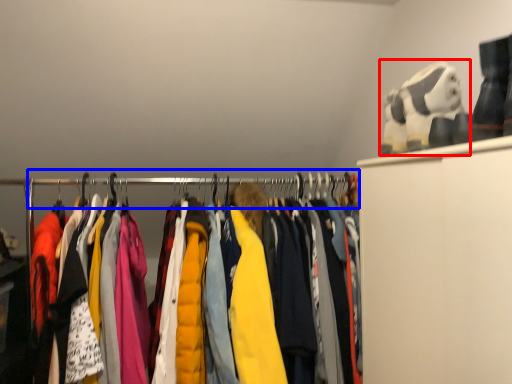
Question: Which object appears farthest to the camera in this image, toy (highlighted by a red box) or clothesline (highlighted by a blue box)?

Choices:
 (A) toy
 (B) clothesline

Answer: (B)